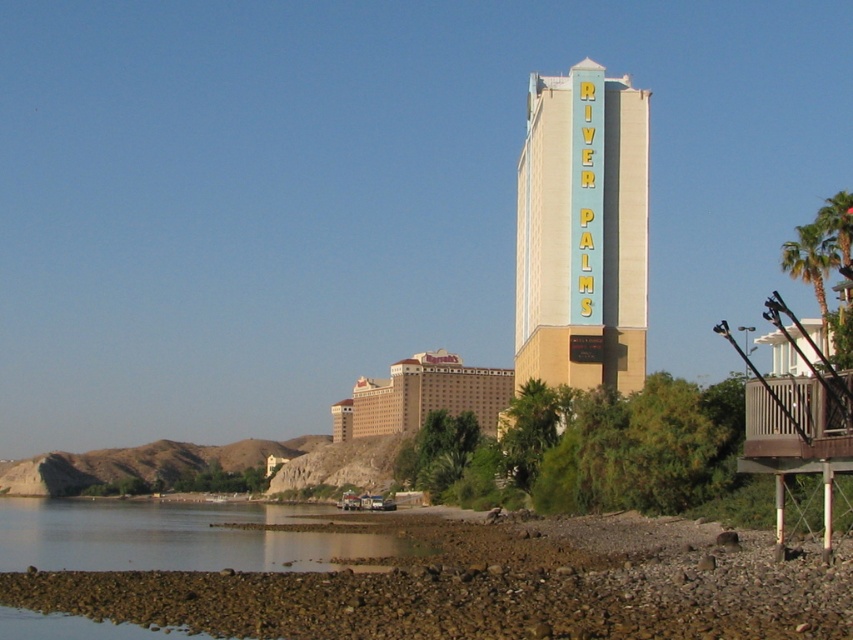
You are standing at the riverside and want to take a photo of the light blue sign at center and the green leafy palm tree at right. Which object will appear closer to you in the photo?

The light blue sign at center will appear closer to you in the photo because the green leafy palm tree at right is behind it.

You are standing at the riverside near the River Palms hotel and want to walk towards the wooden deck. There are two points marked on the path ahead. Which point should you head toward first, point 1 at coordinates point (476,589) or point 2 at coordinates point (96,545)?

You should head toward point 1 at coordinates point (476,589) first because it is in front of point 2 at coordinates point (96,545), meaning it is closer to your current position.